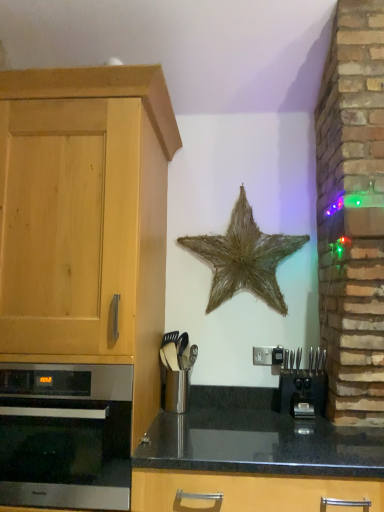
Where is `vacant space underneath rustic straw star at center (from a real-world perspective)`? Image resolution: width=384 pixels, height=512 pixels. vacant space underneath rustic straw star at center (from a real-world perspective) is located at coordinates (230, 384).